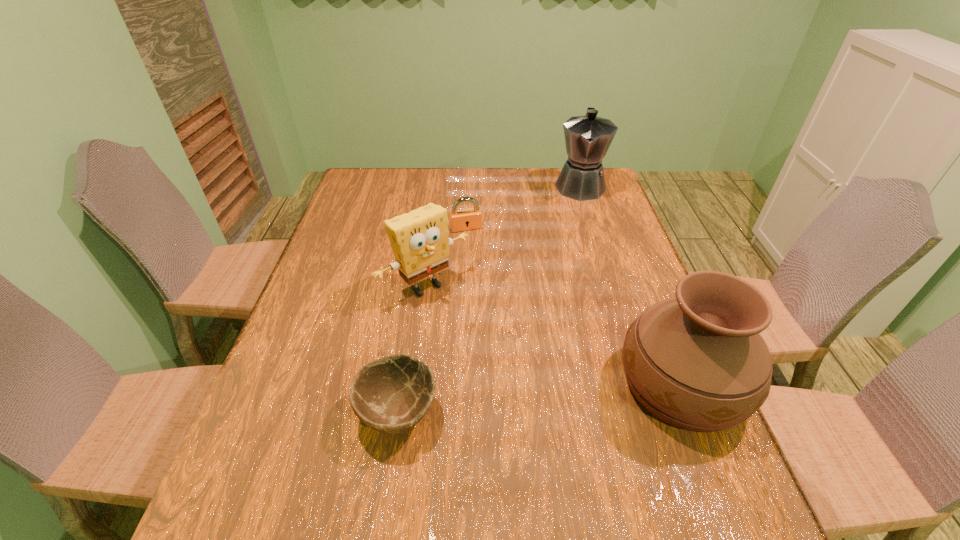
I want to click on urn that is at the right edge, so click(x=697, y=362).

Identify the location of coffeepot that is at the right edge. The height and width of the screenshot is (540, 960). (588, 138).

This screenshot has width=960, height=540. Find the location of `object that is at the far right corner`. object that is at the far right corner is located at coordinates (588, 138).

The width and height of the screenshot is (960, 540). I want to click on object that is at the near right corner, so click(697, 362).

In the image, there is a desktop. In order to click on vacant space at the far edge in this screenshot , I will do `click(425, 179)`.

Find the location of a particular element. vacant region at the near edge of the desktop is located at coordinates (502, 458).

I want to click on free space at the left edge of the desktop, so click(x=276, y=422).

Identify the location of vacant area at the right edge of the desktop. The image size is (960, 540). (635, 284).

The height and width of the screenshot is (540, 960). In order to click on free space at the far left corner of the desktop in this screenshot , I will do pyautogui.click(x=364, y=178).

The image size is (960, 540). Find the location of `free space between the urn and the farthest object`. free space between the urn and the farthest object is located at coordinates (631, 285).